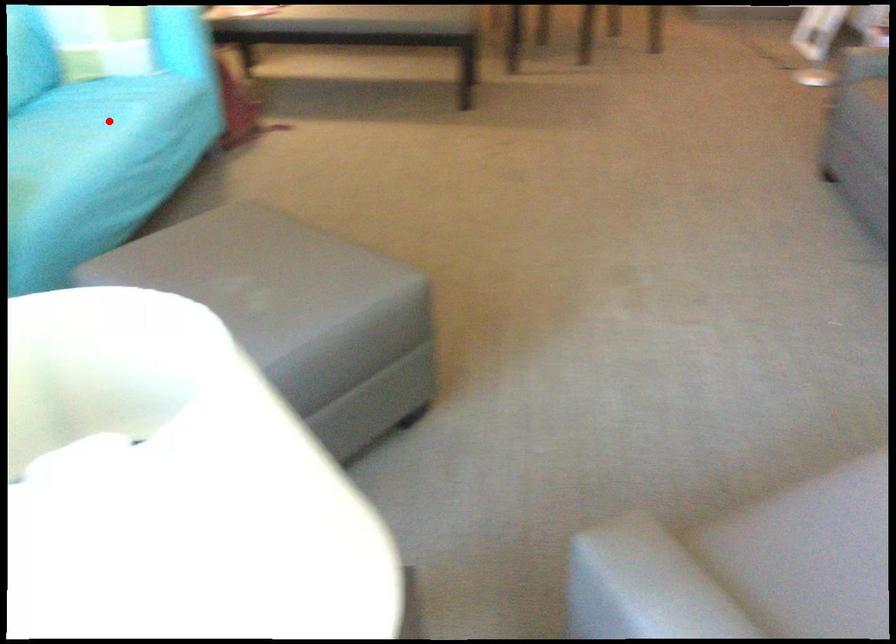
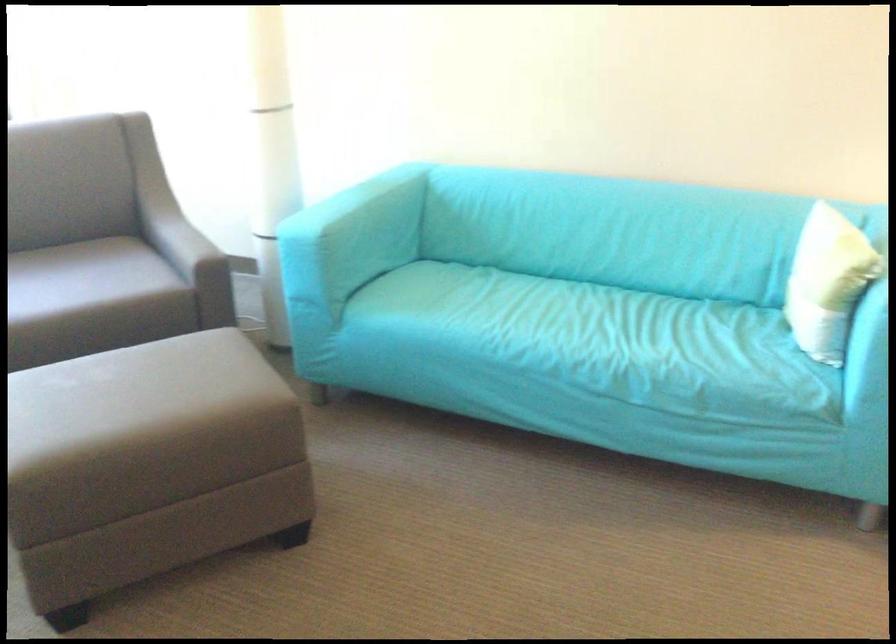
Where in the second image is the point corresponding to the highlighted location from the first image?

(556, 328)